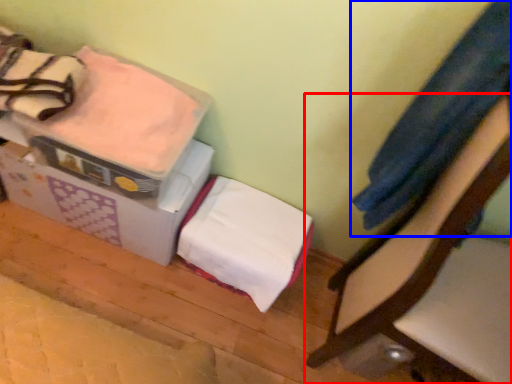
Question: Which object appears closest to the camera in this image, furniture (highlighted by a red box) or clothing (highlighted by a blue box)?

Choices:
 (A) furniture
 (B) clothing

Answer: (A)